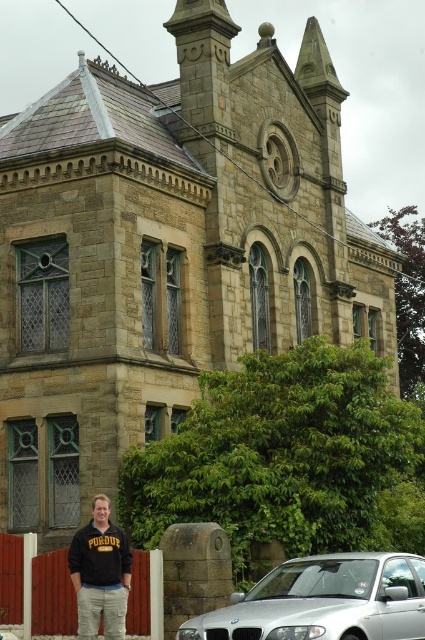
Who is positioned more to the right, silver metallic car at lower center or black sweatshirt at lower left?

silver metallic car at lower center

Does silver metallic car at lower center have a greater height compared to black sweatshirt at lower left?

Correct, silver metallic car at lower center is much taller as black sweatshirt at lower left.

Does point (302, 564) come in front of point (107, 502)?

Yes, point (302, 564) is closer to viewer.

Where is `silver metallic car at lower center`? silver metallic car at lower center is located at coordinates (325, 602).